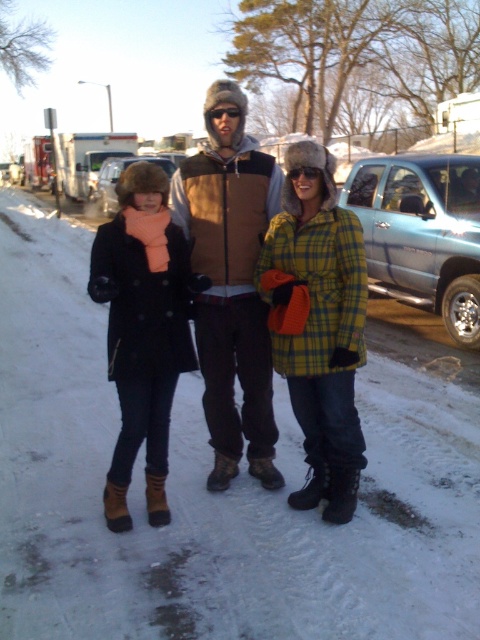
Question: Which point is closer to the camera?

Choices:
 (A) (352, 368)
 (B) (202, 314)
 (C) (145, 211)

Answer: (C)

Question: Can you confirm if plaid fabric coat at center is positioned above matte black coat at left?

Choices:
 (A) yes
 (B) no

Answer: (A)

Question: Can you confirm if plaid fabric coat at center is positioned below brown suede vest at center?

Choices:
 (A) no
 (B) yes

Answer: (B)

Question: Which object appears farthest from the camera in this image?

Choices:
 (A) matte black coat at left
 (B) brown suede vest at center

Answer: (B)

Question: Which object appears farthest from the camera in this image?

Choices:
 (A) plaid fabric coat at center
 (B) matte black coat at left
 (C) brown suede vest at center

Answer: (C)

Question: Is plaid fabric coat at center in front of brown suede vest at center?

Choices:
 (A) yes
 (B) no

Answer: (A)